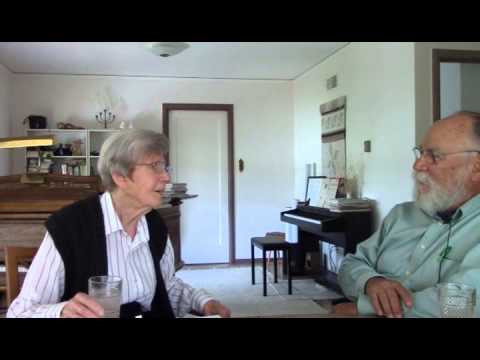
Identify the location of glass. (109, 286), (453, 299).